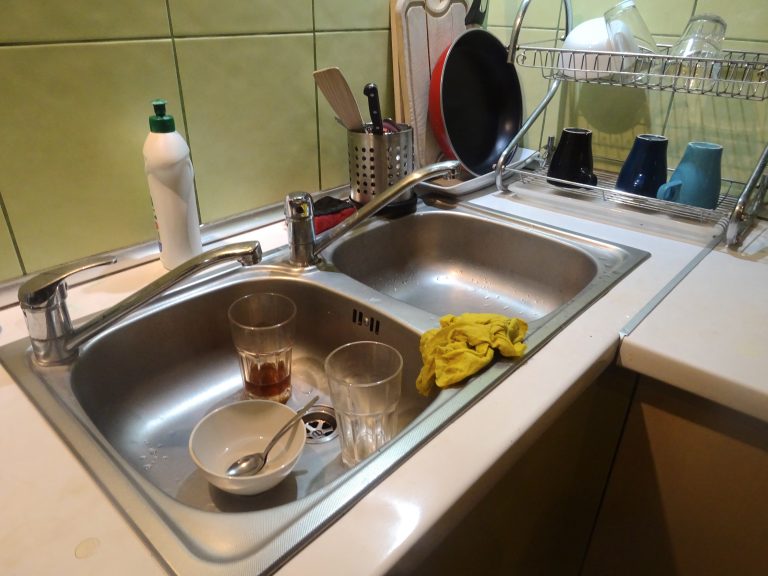
What are the coordinates of `sink` in the screenshot? It's located at (190, 386), (464, 287).